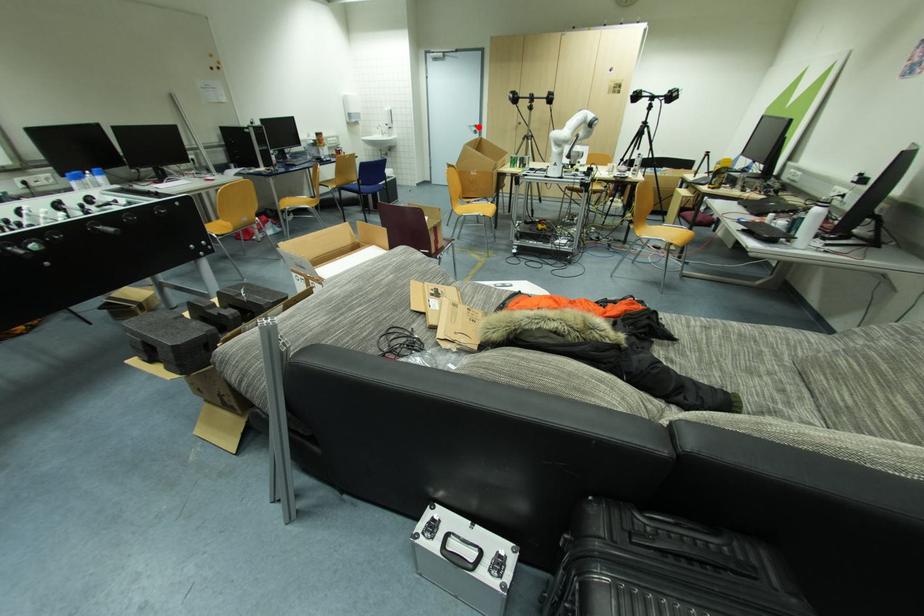
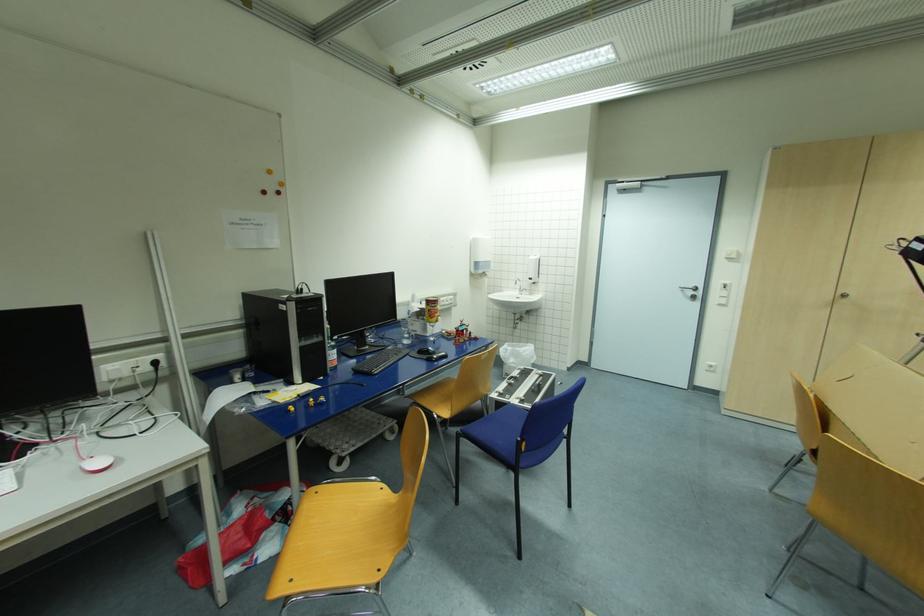
In the second image, find the point that corresponds to the highlighted location in the first image.

(699, 289)